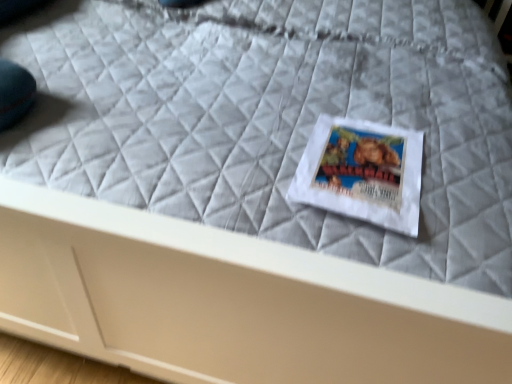
What do you see at coordinates (362, 172) in the screenshot?
I see `white paper at center` at bounding box center [362, 172].

The image size is (512, 384). Find the location of `white paper at center`. white paper at center is located at coordinates (362, 172).

The image size is (512, 384). Find the location of `white paper at center`. white paper at center is located at coordinates (362, 172).